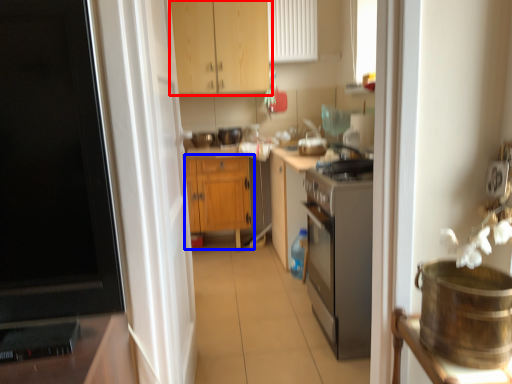
Question: Which point is closer to the camera, cabinetry (highlighted by a red box) or cabinetry (highlighted by a blue box)?

Choices:
 (A) cabinetry
 (B) cabinetry

Answer: (A)